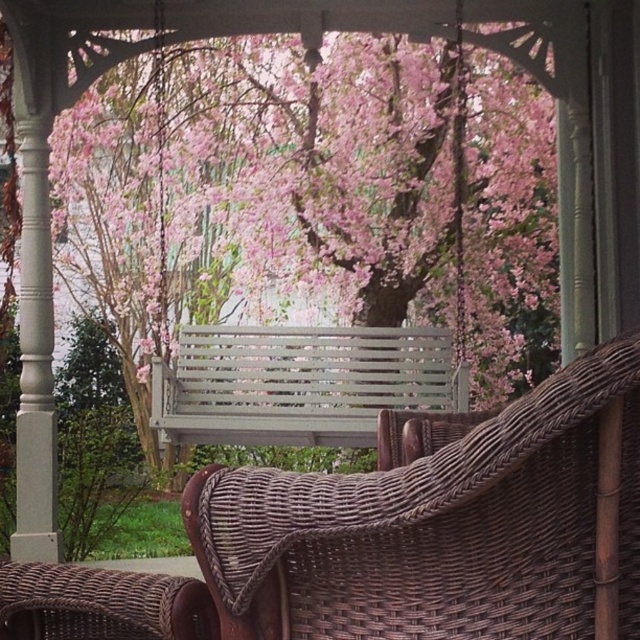
Who is positioned more to the left, pink blossoms at center or brown wicker armchair at center?

pink blossoms at center is more to the left.

Can you confirm if pink blossoms at center is positioned above brown wicker armchair at center?

Yes, pink blossoms at center is above brown wicker armchair at center.

The height and width of the screenshot is (640, 640). I want to click on pink blossoms at center, so click(269, 157).

Does brown wicker armchair at center appear under gray slatted bench at center?

Correct, brown wicker armchair at center is located below gray slatted bench at center.

Is brown wicker armchair at center closer to the viewer compared to gray slatted bench at center?

Yes, it is in front of gray slatted bench at center.

I want to click on brown wicker armchair at center, so click(444, 528).

Is pink blossoms at center bigger than gray slatted bench at center?

Indeed, pink blossoms at center has a larger size compared to gray slatted bench at center.

Does pink blossoms at center come in front of gray slatted bench at center?

No, pink blossoms at center is further to the viewer.

Locate an element on the screen. Image resolution: width=640 pixels, height=640 pixels. pink blossoms at center is located at coordinates (269, 157).